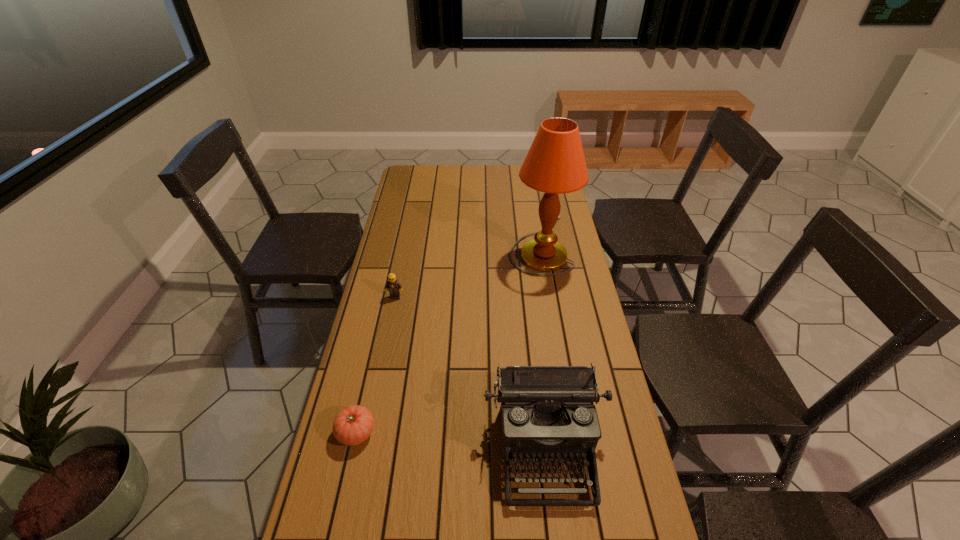
I want to click on tomato at the left edge, so click(354, 424).

The width and height of the screenshot is (960, 540). I want to click on lamp that is at the right edge, so click(555, 163).

Locate an element on the screen. Image resolution: width=960 pixels, height=540 pixels. typewriter present at the right edge is located at coordinates pos(547,411).

What are the coordinates of `free space at the far edge of the desktop` in the screenshot? It's located at (485, 180).

The image size is (960, 540). In the image, there is a desktop. What are the coordinates of `vacant space at the left edge` in the screenshot? It's located at click(378, 278).

In the image, there is a desktop. Where is `vacant space at the right edge`? The height and width of the screenshot is (540, 960). vacant space at the right edge is located at coordinates (611, 539).

What are the coordinates of `free space at the far left corner of the desktop` in the screenshot? It's located at (401, 177).

You are a GUI agent. You are given a task and a screenshot of the screen. Output one action in this format:
    pyautogui.click(x=<x>, y=<y>)
    Task: Click on the free spot between the shortest object and the second tallest object
    This screenshot has width=960, height=540.
    Given the screenshot: What is the action you would take?
    pyautogui.click(x=450, y=440)

Where is `empty space that is in between the lamp and the second shortest object`? empty space that is in between the lamp and the second shortest object is located at coordinates (468, 271).

The height and width of the screenshot is (540, 960). I want to click on free space between the tallest object and the third shortest object, so click(x=542, y=346).